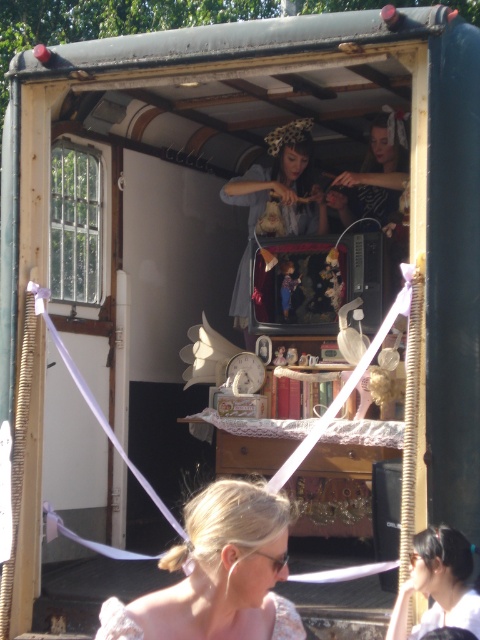
You are a photographer taking a picture of the scene. You notice the blonde hair at center and the matte gray dress at center. Which one should you adjust to ensure they are aligned properly for the photo?

The blonde hair at center is to the left of matte gray dress at center, so you should move the blonde hair at center to the right or the matte gray dress at center to the left to align them properly.

You are standing inside the vintage trailer and want to take a photo of the blonde hair at center. Where should you position yourself to capture it in the frame?

The blonde hair at center is located at point 0.897 on the x and 0.454 on the y coordinates, so position yourself in the center of the trailer facing towards the middle to capture it in the frame.